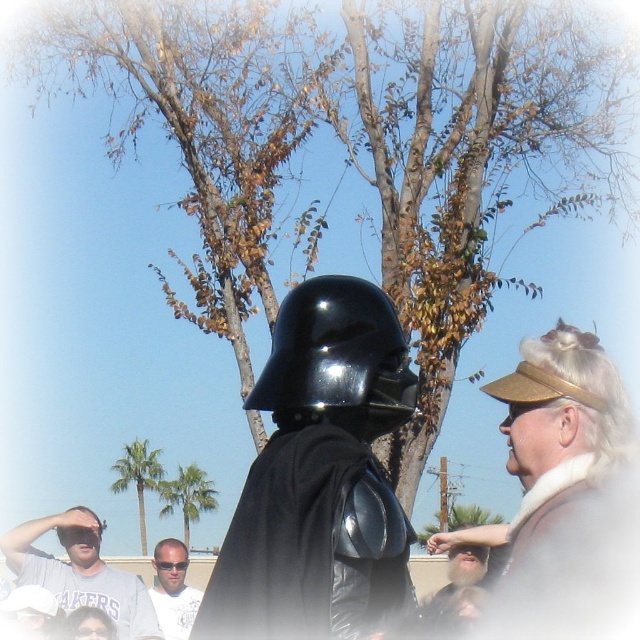
Looking at this image, you are a photographer trying to capture both the glossy black helmet at center and the light brown hair at center in a single frame. Based on their sizes in the image, which object should you focus on first to ensure both are in focus?

The glossy black helmet at center is smaller than light brown hair at center, so you should focus on the light brown hair at center first as it is larger and will be easier to capture clearly in the frame.

You are a photographer trying to capture the Darth Vader costume in the center of your photo. The camera you are using has a focus point at point [337,360]. Will this focus point align with the glossy black helmet at center?

The glossy black helmet at center is located at point [337,360], so yes, the focus point will align with the glossy black helmet at center.